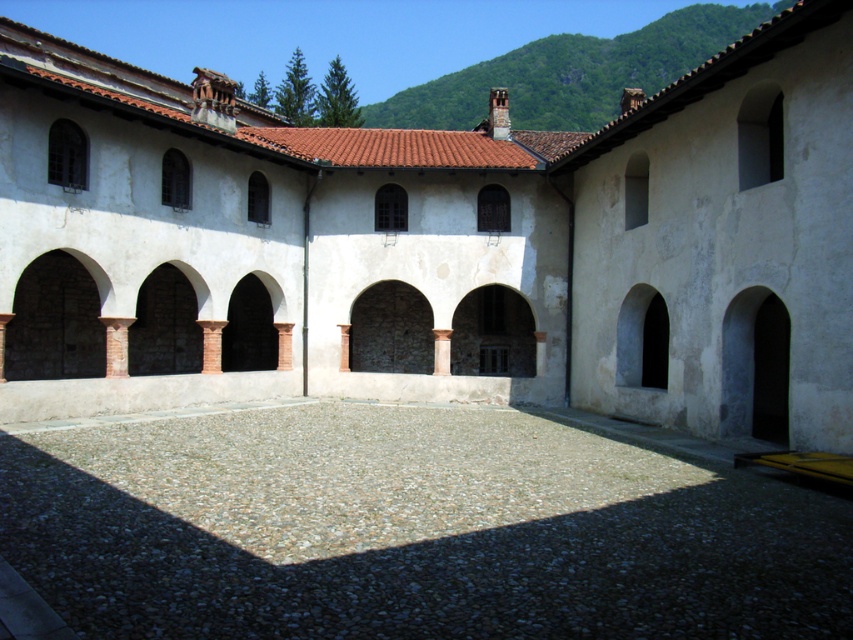
Can you confirm if gray gravel at center is thinner than dark gray stone archway at lower right?

Incorrect, gray gravel at center's width is not less than dark gray stone archway at lower right's.

Based on the photo, is gray gravel at center to the left of dark gray stone archway at lower right from the viewer's perspective?

Correct, you'll find gray gravel at center to the left of dark gray stone archway at lower right.

Describe the element at coordinates (410, 531) in the screenshot. I see `gray gravel at center` at that location.

At what (x,y) coordinates should I click in order to perform the action: click on gray gravel at center. Please return your answer as a coordinate pair (x, y). The width and height of the screenshot is (853, 640). Looking at the image, I should click on (410, 531).

Is white stone courtyard at center bigger than dark brown stone archway at center?

Correct, white stone courtyard at center is larger in size than dark brown stone archway at center.

What do you see at coordinates (427, 234) in the screenshot? I see `white stone courtyard at center` at bounding box center [427, 234].

Where is `white stone courtyard at center`? The image size is (853, 640). white stone courtyard at center is located at coordinates (427, 234).

Does gray gravel at center have a smaller size compared to dark stone archway at center?

No.

Between gray gravel at center and dark stone archway at center, which one appears on the right side from the viewer's perspective?

Positioned to the right is dark stone archway at center.

This screenshot has width=853, height=640. What do you see at coordinates (410, 531) in the screenshot? I see `gray gravel at center` at bounding box center [410, 531].

Find the location of a particular element. Image resolution: width=853 pixels, height=640 pixels. gray gravel at center is located at coordinates (410, 531).